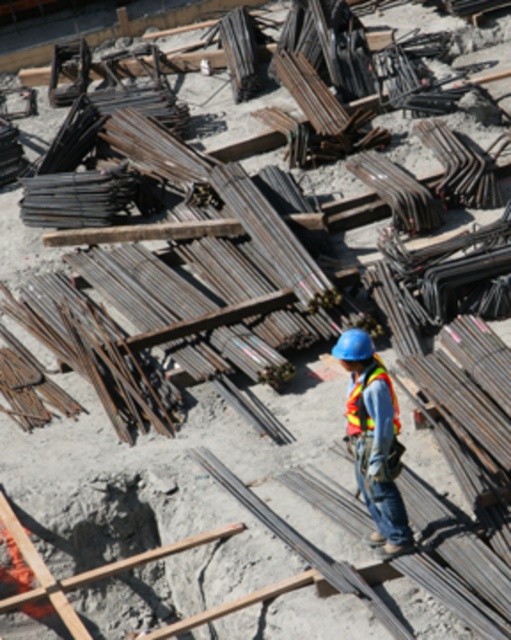
Question: Which point is closer to the camera?

Choices:
 (A) (360, 353)
 (B) (399, 429)

Answer: (A)

Question: Can you confirm if reflective orange safety vest at center is positioned to the left of blue hard hat at center?

Choices:
 (A) no
 (B) yes

Answer: (A)

Question: Does reflective orange safety vest at center appear on the right side of blue hard hat at center?

Choices:
 (A) yes
 (B) no

Answer: (A)

Question: Among these points, which one is farthest from the camera?

Choices:
 (A) (349, 422)
 (B) (375, 480)
 (C) (353, 346)

Answer: (A)

Question: Is reflective fabric safety vest at center to the left of blue hard hat at center from the viewer's perspective?

Choices:
 (A) yes
 (B) no

Answer: (B)

Question: Which is nearer to the reflective orange safety vest at center?

Choices:
 (A) reflective fabric safety vest at center
 (B) blue hard hat at center

Answer: (A)